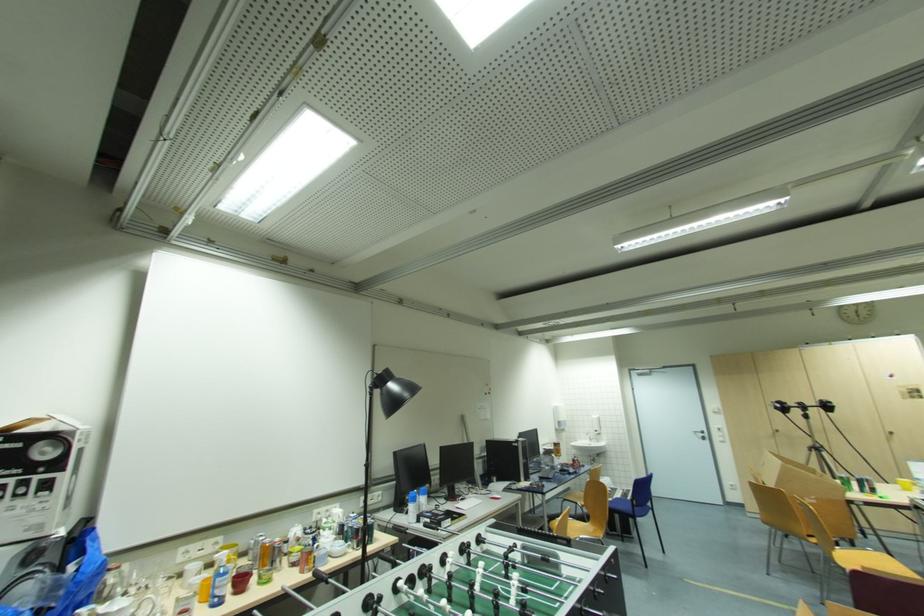
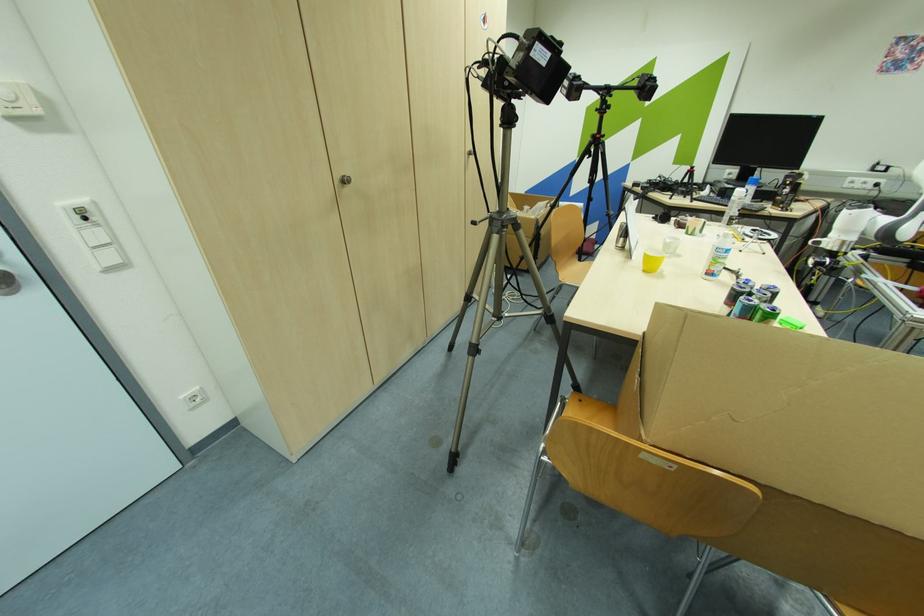
Find the pixel in the second image that matches point 781,431 in the first image.

(348, 182)